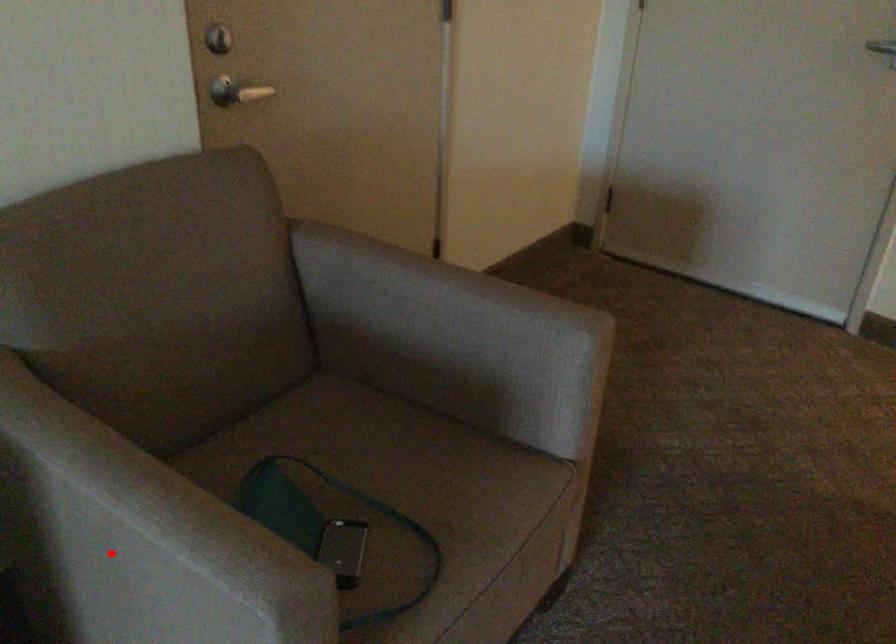
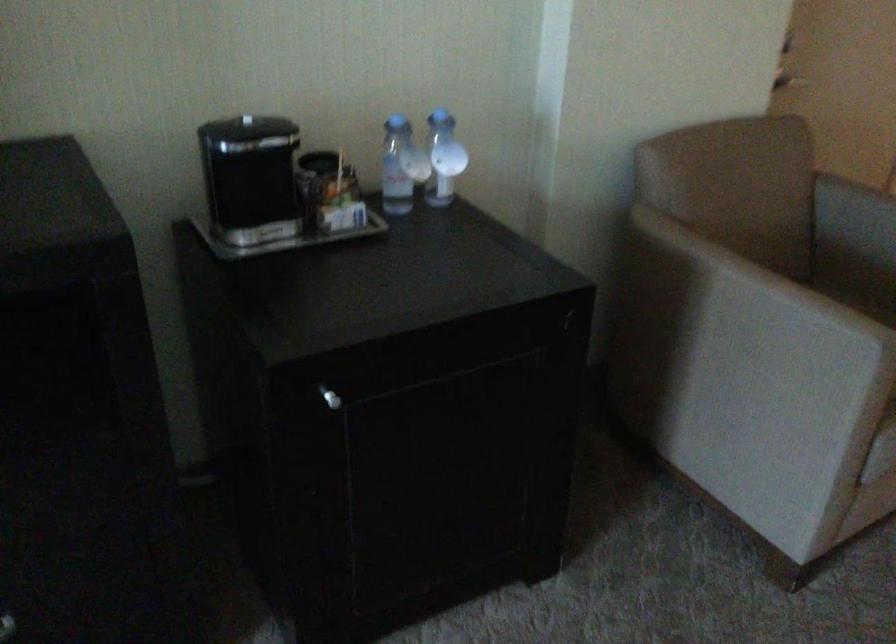
Locate, in the second image, the point that corresponds to the highlighted location in the first image.

(739, 319)